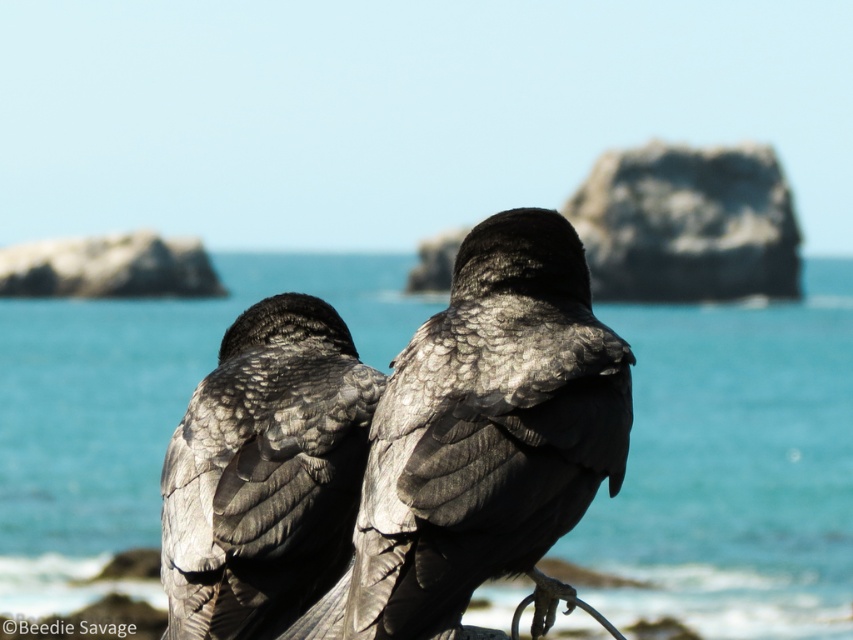
Can you confirm if shiny black raven at center is positioned above gray textured feathers at center?

No.

Does shiny black raven at center appear on the right side of gray textured feathers at center?

Yes, shiny black raven at center is to the right of gray textured feathers at center.

This screenshot has height=640, width=853. Describe the element at coordinates (485, 435) in the screenshot. I see `shiny black raven at center` at that location.

In order to click on shiny black raven at center in this screenshot , I will do `click(485, 435)`.

This screenshot has height=640, width=853. Describe the element at coordinates (734, 465) in the screenshot. I see `blue water at center` at that location.

Can you confirm if blue water at center is positioned to the right of gray textured feathers at center?

No, blue water at center is not to the right of gray textured feathers at center.

You are a GUI agent. You are given a task and a screenshot of the screen. Output one action in this format:
    pyautogui.click(x=<x>, y=<y>)
    Task: Click on the blue water at center
    The image size is (853, 640).
    Given the screenshot: What is the action you would take?
    734,465

Which is more to the right, blue water at center or shiny black raven at center?

Positioned to the right is shiny black raven at center.

Who is positioned more to the left, blue water at center or shiny black raven at center?

From the viewer's perspective, blue water at center appears more on the left side.

Between point (630, 461) and point (508, 236), which one is positioned behind?

Point (630, 461)

Where is `blue water at center`? This screenshot has width=853, height=640. blue water at center is located at coordinates (734, 465).